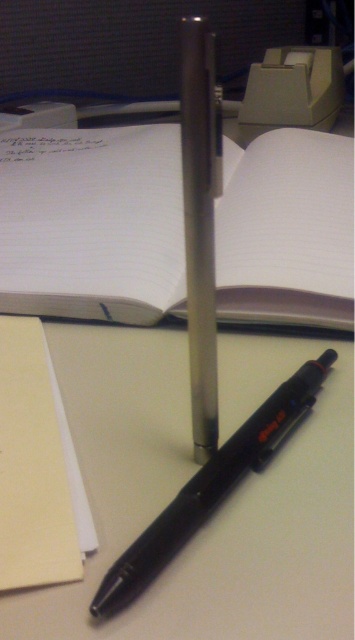
In the scene shown: You are organizing your desk and need to place a new item between the white paper notebook at center and the black matte pen at center. Based on their current positions, where should you place the new item to ensure it is between them?

The white paper notebook at center is located above the black matte pen at center, so placing the new item between them would require positioning it below the notebook and above the pen.

You need to write a long report and have both the white paper notebook at center and the yellow paper at lower left available. Which one should you choose for more space?

The white paper notebook at center has a larger size compared to the yellow paper at lower left, so you should choose the white paper notebook at center for more space.

You are a person with a 40 cm long arm. You want to reach the white paper notebook at center from your current position. Can you reach it?

The white paper notebook at center is 44.52 centimeters away from the viewer. Since your arm is only 40 cm long, you cannot reach it without moving closer.